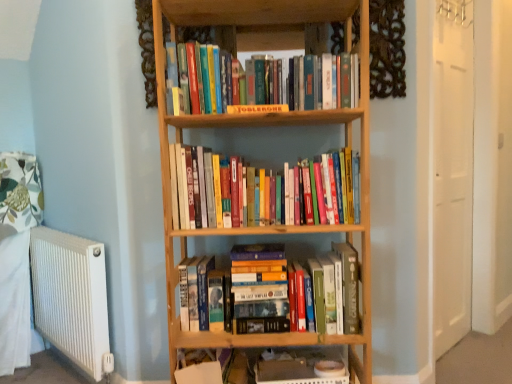
This screenshot has height=384, width=512. What do you see at coordinates (265, 126) in the screenshot?
I see `natural wood bookcase at center` at bounding box center [265, 126].

Measure the distance between natural wood bookcase at center and camera.

The distance of natural wood bookcase at center from camera is 1.37 meters.

What do you see at coordinates (259, 270) in the screenshot? I see `hardcover books at center, placed as the first book when sorted from bottom to top` at bounding box center [259, 270].

Measure the distance between point (192,86) and camera.

The distance of point (192,86) from camera is 4.86 feet.

The image size is (512, 384). I want to click on matte yellow book at center, so click(257, 109).

Which is closer, [33,270] or [207,383]?

Point [33,270] is farther from the camera than point [207,383].

Is there a large distance between white metallic radiator at left and wooden shelf at lower center?

That's not correct — white metallic radiator at left is a little close to wooden shelf at lower center.

From a real-world perspective, which is physically below, white metallic radiator at left or wooden shelf at lower center?

→ wooden shelf at lower center, from a real-world perspective.

Looking at this image, would you say wooden shelf at lower center is part of white metallic radiator at left's contents?

Actually, wooden shelf at lower center is outside white metallic radiator at left.

How many degrees apart are the facing directions of natural wood bookcase at center and hardcover books at upper center, placed as the 3th book when sorted from bottom to top?

0.805 degrees separate the facing orientations of natural wood bookcase at center and hardcover books at upper center, placed as the 3th book when sorted from bottom to top.

Which object is more forward, natural wood bookcase at center or hardcover books at upper center, placed as the 3th book when sorted from bottom to top?

natural wood bookcase at center.

Is point (258, 45) closer to camera compared to point (272, 77)?

No, (258, 45) is further to viewer.

Which of these two, white metallic radiator at left or natural wood bookcase at center, is wider?

natural wood bookcase at center.

Does white metallic radiator at left have a greater height compared to natural wood bookcase at center?

No, white metallic radiator at left is not taller than natural wood bookcase at center.

From a real-world perspective, which object rests below the other?

In real-world perspective, white metallic radiator at left is lower.

From the image's perspective, which one is positioned lower, hardcover books at center, positioned as the third book in top-to-bottom order, or white metallic radiator at left?

white metallic radiator at left appears lower in the image.

Is hardcover books at center, positioned as the third book in top-to-bottom order, wider or thinner than white metallic radiator at left?

hardcover books at center, positioned as the third book in top-to-bottom order, is wider than white metallic radiator at left.

Are hardcover books at center, positioned as the third book in top-to-bottom order, and white metallic radiator at left far apart?

They are positioned close to each other.

Image resolution: width=512 pixels, height=384 pixels. Identify the location of shelf lying on the right of hardcover books at center, positioned as the third book in top-to-bottom order. (259, 366).

Which is in front, hardcover books at center, placed as the first book when sorted from bottom to top, or wooden shelf at lower center?

hardcover books at center, placed as the first book when sorted from bottom to top, is closer to the camera.

Considering the positions of point (353, 280) and point (262, 383), is point (353, 280) closer or farther from the camera than point (262, 383)?

Point (353, 280) is positioned closer to the camera compared to point (262, 383).

Considering the positions of objects natural wood bookcase at center and matte yellow book at center in the image provided, who is behind, natural wood bookcase at center or matte yellow book at center?

matte yellow book at center is more distant.

Is natural wood bookcase at center oriented away from matte yellow book at center?

Correct, natural wood bookcase at center is looking away from matte yellow book at center.

Is natural wood bookcase at center not near matte yellow book at center?

Actually, natural wood bookcase at center and matte yellow book at center are a little close together.

Can you confirm if natural wood bookcase at center is taller than matte yellow book at center?

Indeed, natural wood bookcase at center has a greater height compared to matte yellow book at center.

Considering the relative sizes of matte yellow book at center and white metallic radiator at left in the image provided, is matte yellow book at center taller than white metallic radiator at left?

Incorrect, the height of matte yellow book at center is not larger of that of white metallic radiator at left.

Does matte yellow book at center turn towards white metallic radiator at left?

No, matte yellow book at center is not facing towards white metallic radiator at left.

Between matte yellow book at center and white metallic radiator at left, which one has larger width?

With larger width is white metallic radiator at left.

Which is in front, matte yellow book at center or white metallic radiator at left?

matte yellow book at center is more forward.

Identify the location of radiator located above the wooden shelf at lower center (from a real-world perspective). This screenshot has width=512, height=384. (72, 298).

I want to click on bookcase below the hardcover books at upper center, the 1th book when ordered from top to bottom (from a real-world perspective), so click(x=265, y=126).

When comparing their distances from matte yellow book at center, does hardcover books at upper center, the 1th book when ordered from top to bottom, or white metallic radiator at left seem closer?

Among the two, hardcover books at upper center, the 1th book when ordered from top to bottom, is located nearer to matte yellow book at center.

From the image, which object appears to be farther from hardcover books at center, the second book from the bottom, hardcover books at center, positioned as the third book in top-to-bottom order, or hardcover books at upper center, the 1th book when ordered from top to bottom?

hardcover books at center, positioned as the third book in top-to-bottom order, lies further to hardcover books at center, the second book from the bottom, than the other object.

Considering their positions, is hardcover books at center, the second book in the top-to-bottom sequence, positioned further to matte yellow book at center than natural wood bookcase at center?

Among the two, natural wood bookcase at center is located further to matte yellow book at center.

Which object lies further to the anchor point matte yellow book at center, hardcover books at upper center, placed as the 3th book when sorted from bottom to top, or wooden shelf at lower center?

The object further to matte yellow book at center is wooden shelf at lower center.

Looking at the image, which one is located closer to natural wood bookcase at center, white metallic radiator at left or wooden shelf at lower center?

Among the two, wooden shelf at lower center is located nearer to natural wood bookcase at center.

From the image, which object appears to be farther from white metallic radiator at left, hardcover books at center, the second book from the bottom, or hardcover books at upper center, placed as the 3th book when sorted from bottom to top?

hardcover books at upper center, placed as the 3th book when sorted from bottom to top, is positioned further to the anchor white metallic radiator at left.

Which object lies further to the anchor point hardcover books at center, the second book from the bottom, natural wood bookcase at center or matte yellow book at center?

The object further to hardcover books at center, the second book from the bottom, is matte yellow book at center.

Consider the image. When comparing their distances from white metallic radiator at left, does matte yellow book at center or hardcover books at center, the second book from the bottom, seem further?

matte yellow book at center lies further to white metallic radiator at left than the other object.

Where is `book between hardcover books at upper center, placed as the 3th book when sorted from bottom to top, and natural wood bookcase at center in the up-down direction`? book between hardcover books at upper center, placed as the 3th book when sorted from bottom to top, and natural wood bookcase at center in the up-down direction is located at coordinates (x=261, y=191).

Find the location of a particular element. book between hardcover books at upper center, placed as the 3th book when sorted from bottom to top, and hardcover books at center, placed as the first book when sorted from bottom to top, from top to bottom is located at coordinates (261, 191).

This screenshot has width=512, height=384. What are the coordinates of `paperback book between hardcover books at upper center, the 1th book when ordered from top to bottom, and hardcover books at center, the second book from the bottom, in the vertical direction` in the screenshot? It's located at (257, 109).

Where is `book that lies between matte yellow book at center and natural wood bookcase at center from top to bottom`? The width and height of the screenshot is (512, 384). book that lies between matte yellow book at center and natural wood bookcase at center from top to bottom is located at coordinates (261, 191).